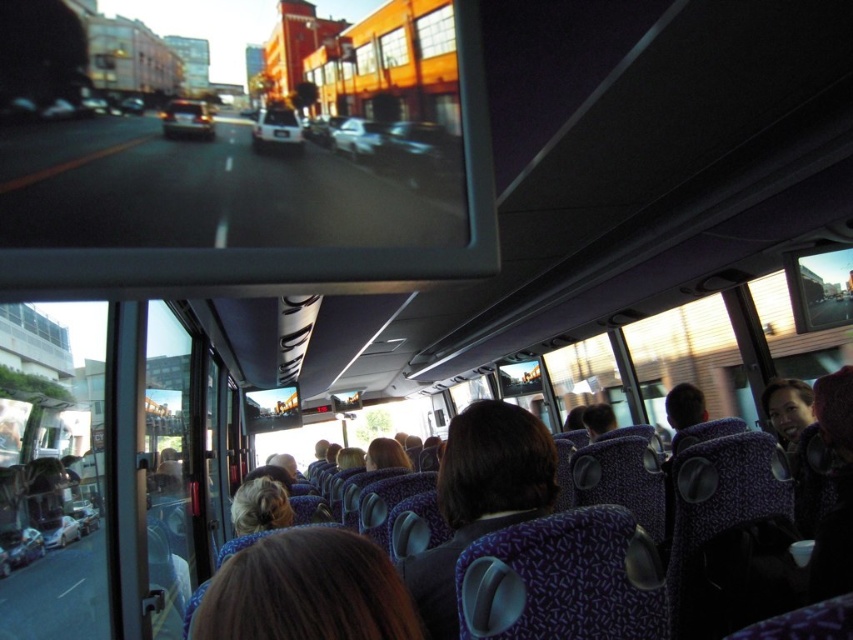
Question: Which object is positioned farthest from the blonde hair at center?

Choices:
 (A) purple fabric seat at center
 (B) brown hair at center
 (C) matte black hair at upper right

Answer: (C)

Question: Can you confirm if brown hair at center is smaller than blonde hair at center?

Choices:
 (A) no
 (B) yes

Answer: (B)

Question: Can you confirm if brown hair at center is positioned below purple fabric seat at center?

Choices:
 (A) no
 (B) yes

Answer: (A)

Question: Considering the relative positions of brown hair at center and matte black hair at upper right in the image provided, where is brown hair at center located with respect to matte black hair at upper right?

Choices:
 (A) below
 (B) above

Answer: (B)

Question: Which object is positioned closest to the blonde hair at center?

Choices:
 (A) matte black hair at upper right
 (B) brown hair at center
 (C) purple fabric seat at center

Answer: (C)

Question: Which point is farther from the camera taking this photo?

Choices:
 (A) (x=784, y=417)
 (B) (x=239, y=496)
 (C) (x=453, y=480)
 (D) (x=312, y=621)

Answer: (A)